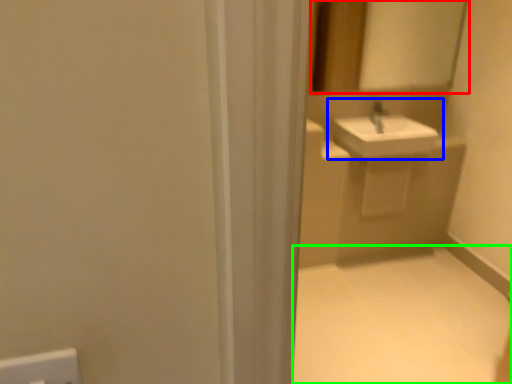
Question: Which object is the farthest from mirror (highlighted by a red box)? Choose among these: sink (highlighted by a blue box) or plain (highlighted by a green box).

Choices:
 (A) sink
 (B) plain

Answer: (B)